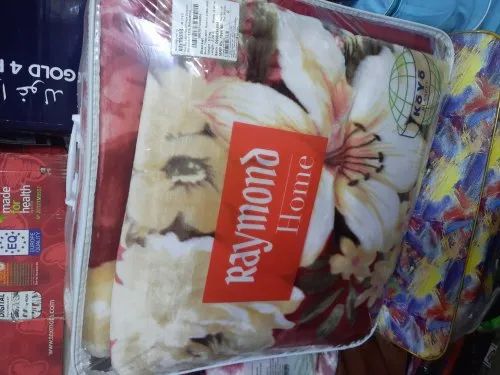
This screenshot has height=375, width=500. Find the location of `white handle`. white handle is located at coordinates (70, 162).